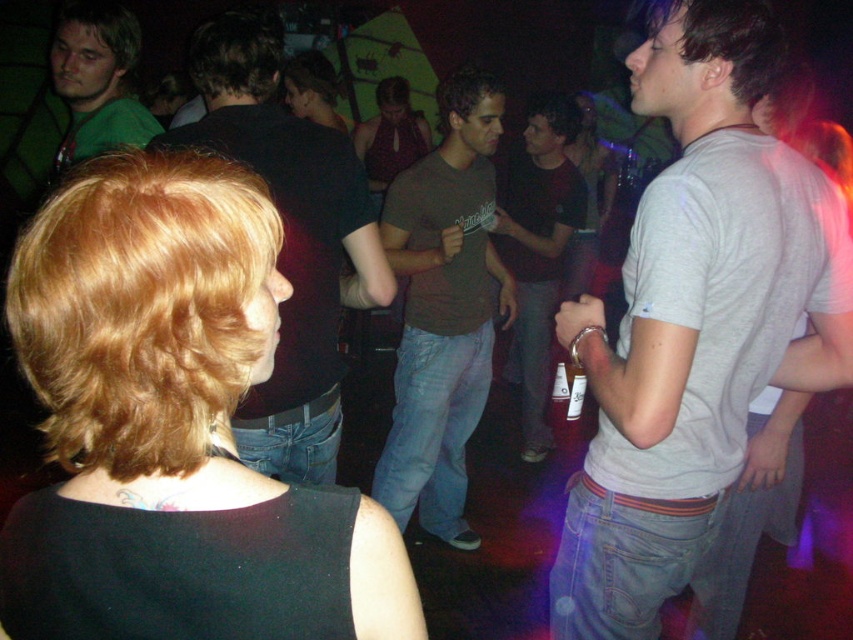
Consider the image. You are standing in the nightclub and need to pass between the dark brown shirt at center and the brown cotton shirt at center to reach the exit. Your body is 2 feet wide. Can you fit through the space between them?

The distance between the dark brown shirt at center and the brown cotton shirt at center is 4.97 feet. Since your body is 2 feet wide, you can easily fit through the space between them as there is sufficient room.